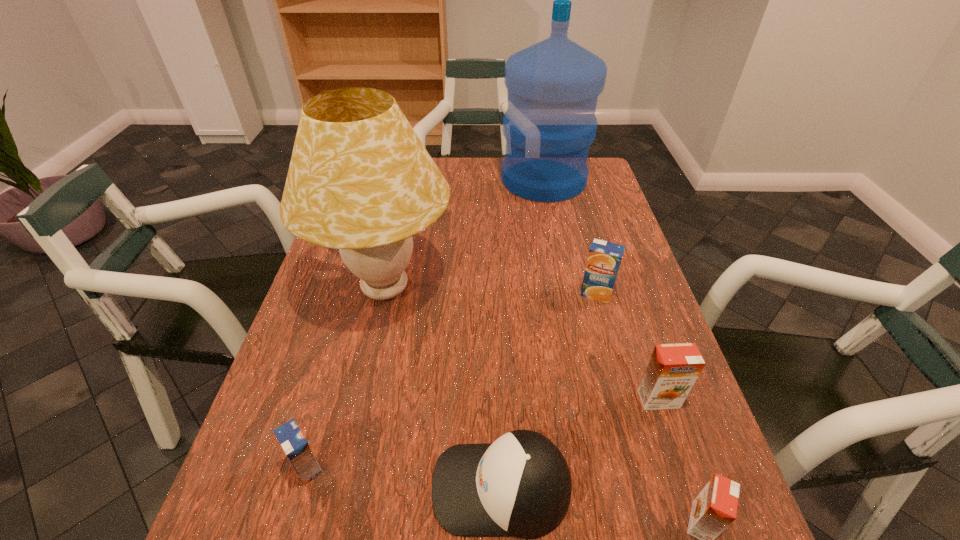
Where is `empty space between the blue water jug and the gray cap`? The height and width of the screenshot is (540, 960). empty space between the blue water jug and the gray cap is located at coordinates click(x=522, y=333).

At what (x,y) coordinates should I click in order to perform the action: click on vacant point located between the second farthest orange juice and the yellow lampshade. Please return your answer as a coordinate pair (x, y). Image resolution: width=960 pixels, height=540 pixels. Looking at the image, I should click on (522, 344).

Identify which object is the fourth closest to the smaller orange orange juice. Please provide its 2D coordinates. Your answer should be formatted as a tuple, i.e. [(x, y)], where the tuple contains the x and y coordinates of a point satisfying the conditions above.

[(360, 180)]

Select which object appears as the third closest to the yellow lampshade. Please provide its 2D coordinates. Your answer should be formatted as a tuple, i.e. [(x, y)], where the tuple contains the x and y coordinates of a point satisfying the conditions above.

[(553, 86)]

Image resolution: width=960 pixels, height=540 pixels. Find the location of `the closest orange juice to the third nearest orange juice`. the closest orange juice to the third nearest orange juice is located at coordinates (715, 508).

Identify which orange juice is located as the second nearest to the farther orange orange juice. Please provide its 2D coordinates. Your answer should be formatted as a tuple, i.e. [(x, y)], where the tuple contains the x and y coordinates of a point satisfying the conditions above.

[(604, 258)]

This screenshot has height=540, width=960. I want to click on vacant area in the image that satisfies the following two spatial constraints: 1. on the front side of the bigger orange orange juice; 2. on the right side of the blue water jug, so click(x=588, y=399).

Image resolution: width=960 pixels, height=540 pixels. Identify the location of free space that satisfies the following two spatial constraints: 1. on the back side of the left blue orange_juice; 2. on the left side of the farthest orange juice. (357, 294).